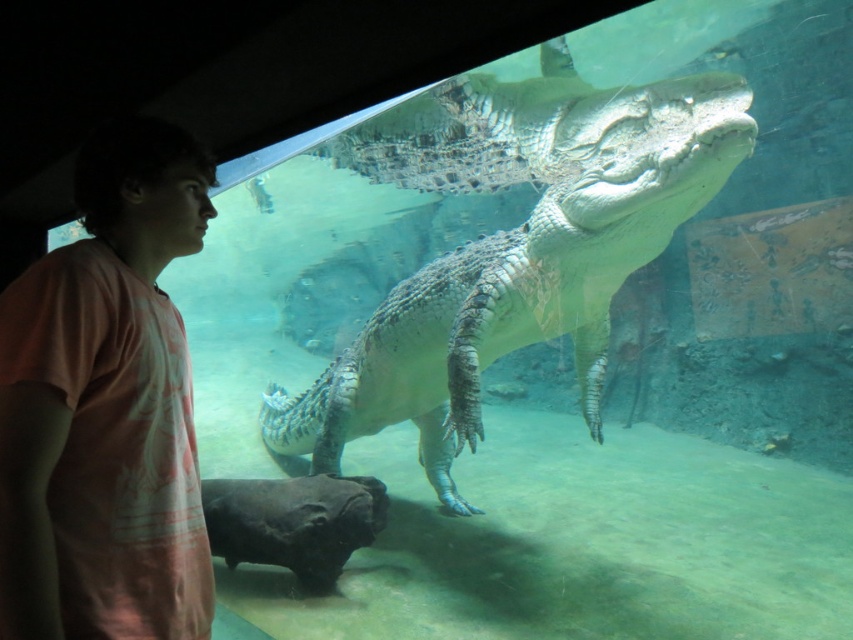
Does gray textured crocodile at center appear on the right side of pink cotton shirt at left?

Yes, gray textured crocodile at center is to the right of pink cotton shirt at left.

Which of these two, gray textured crocodile at center or pink cotton shirt at left, stands taller?

With more height is gray textured crocodile at center.

Measure the distance between gray textured crocodile at center and camera.

A distance of 8.16 feet exists between gray textured crocodile at center and camera.

Identify the location of gray textured crocodile at center. (512, 244).